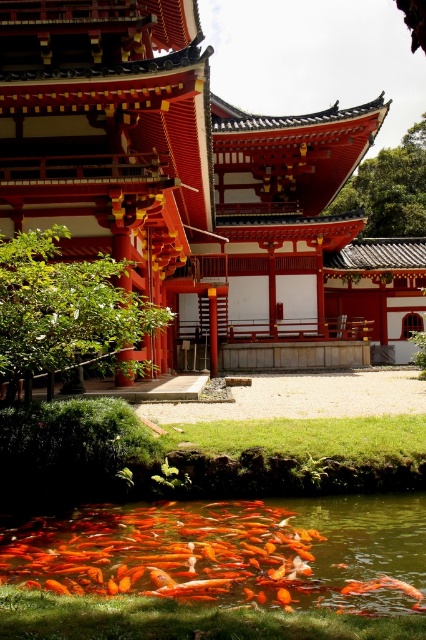
Is smooth red wood temple at center positioned before orange glossy fish at lower center?

Yes.

Locate an element on the screen. This screenshot has height=640, width=426. smooth red wood temple at center is located at coordinates tap(196, 192).

The image size is (426, 640). I want to click on smooth red wood temple at center, so click(x=196, y=192).

Between smooth red wood temple at center and shiny orange fish at lower center, which one has more height?

Standing taller between the two is smooth red wood temple at center.

Between smooth red wood temple at center and shiny orange fish at lower center, which one has less height?

Standing shorter between the two is shiny orange fish at lower center.

Is point (134, 93) in front of point (83, 516)?

No, (134, 93) is behind (83, 516).

This screenshot has width=426, height=640. Identify the location of smooth red wood temple at center. (196, 192).

Based on the photo, between shiny orange fish at lower center and orange glossy fish at lower center, which one appears on the left side from the viewer's perspective?

From the viewer's perspective, shiny orange fish at lower center appears more on the left side.

Is shiny orange fish at lower center wider than orange glossy fish at lower center?

Yes, shiny orange fish at lower center is wider than orange glossy fish at lower center.

Identify the location of shiny orange fish at lower center. (229, 552).

At what (x,y) coordinates should I click in order to perform the action: click on shiny orange fish at lower center. Please return your answer as a coordinate pair (x, y). The height and width of the screenshot is (640, 426). Looking at the image, I should click on (229, 552).